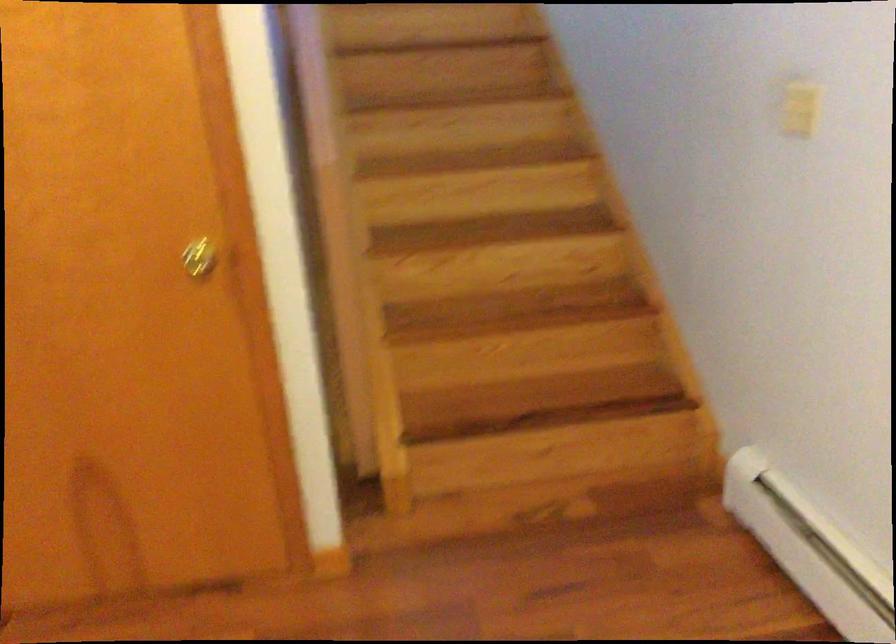
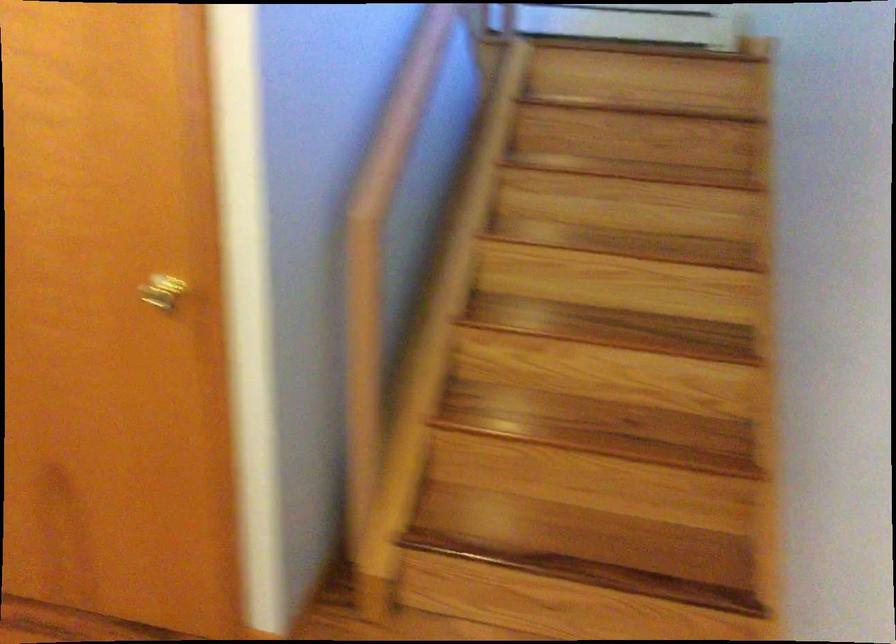
Question: In a continuous first-person perspective shot, in which direction is the camera moving?

Choices:
 (A) Left
 (B) Right
 (C) Forward
 (D) Backward

Answer: (D)